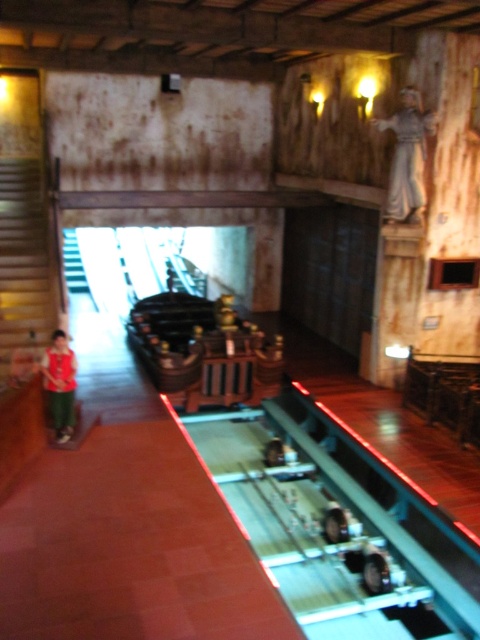
Consider the image. You are standing on the raised platform with a glass barrier in the dimly lit indoor setting. You notice a point marked at coordinates [24,262]. Where is this point located in relation to the wooden staircase at left?

The point at [24,262] is located on the wooden staircase at left.

From the picture: You are standing on the platform and want to move from the point at coordinates point [12,285] to point [50,410]. Which direction should you move to reach your destination?

Since point [12,285] is behind point [50,410], you should move forward to reach point [50,410] from point [12,285].

You are a visitor at this themed exhibit and want to take a photo of the white marble statue at upper right and the matte red shirt at left. Which object should you focus on first if you want to capture both in a single frame without moving your camera?

You should focus on the white marble statue at upper right first because it is taller than the matte red shirt at left, allowing you to adjust the camera angle to include both in the frame.